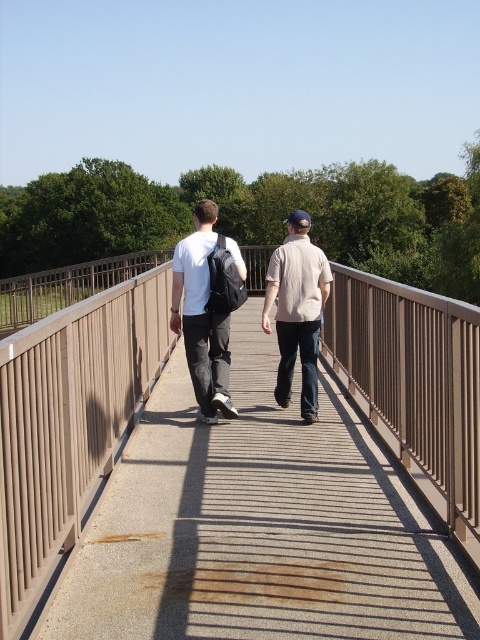
You are standing on the pedestrian bridge and see the white matte backpack at center and the beige cotton shirt at center. Which one is positioned more to the left side of the bridge?

The white matte backpack at center is positioned to the left of the beige cotton shirt at center, so it is more to the left side of the bridge.